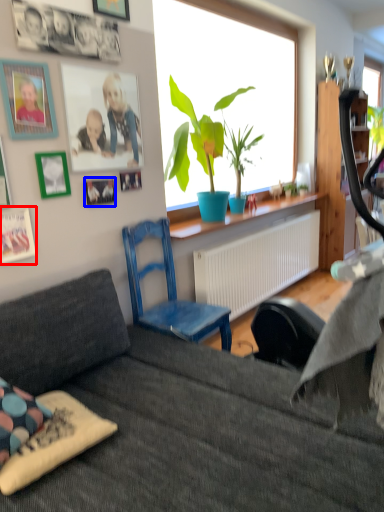
Question: Which object is closer to the camera taking this photo, picture frame (highlighted by a red box) or picture frame (highlighted by a blue box)?

Choices:
 (A) picture frame
 (B) picture frame

Answer: (A)